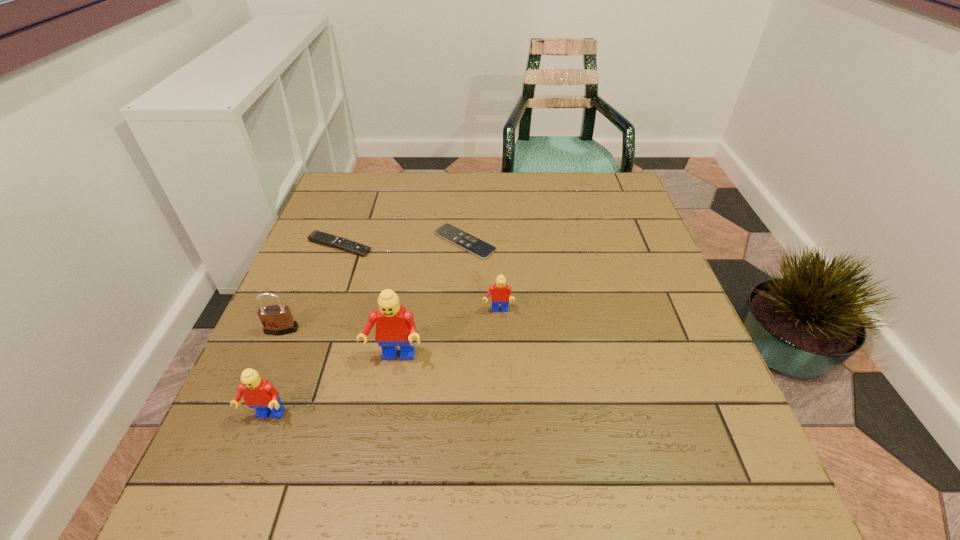
Locate an element on the screen. object located in the near left corner section of the desktop is located at coordinates (258, 393).

Find the location of a particular element. free space at the far edge of the desktop is located at coordinates (567, 205).

Where is `free location at the near edge`? free location at the near edge is located at coordinates (324, 413).

At what (x,y) coordinates should I click in order to perform the action: click on vacant position at the left edge of the desktop. Please return your answer as a coordinate pair (x, y). The width and height of the screenshot is (960, 540). Looking at the image, I should click on (323, 353).

In the image, there is a desktop. Identify the location of blank space at the right edge. Image resolution: width=960 pixels, height=540 pixels. (629, 374).

Find the location of a particular element. vacant space at the far left corner is located at coordinates (328, 200).

This screenshot has width=960, height=540. In the image, there is a desktop. Find the location of `vacant space at the far right corner`. vacant space at the far right corner is located at coordinates (603, 202).

This screenshot has width=960, height=540. Identify the location of free area in between the shortest object and the shortest Lego. [481, 276].

Find the location of a particular element. Image resolution: width=960 pixels, height=540 pixels. vacant area between the second shortest object and the second nearest Lego is located at coordinates (368, 302).

At what (x,y) coordinates should I click in order to perform the action: click on empty location between the second shortest object and the shorter remote control. Please return your answer as a coordinate pair (x, y). The height and width of the screenshot is (540, 960). Looking at the image, I should click on (402, 244).